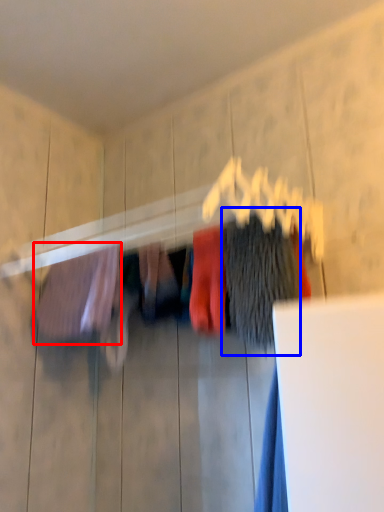
Question: Which object is further to the camera taking this photo, clothing (highlighted by a red box) or clothing (highlighted by a blue box)?

Choices:
 (A) clothing
 (B) clothing

Answer: (A)